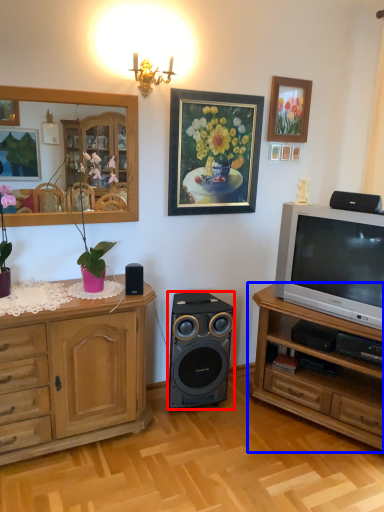
Question: Among these objects, which one is nearest to the camera, loudspeaker (highlighted by a red box) or chest of drawers (highlighted by a blue box)?

Choices:
 (A) loudspeaker
 (B) chest of drawers

Answer: (B)